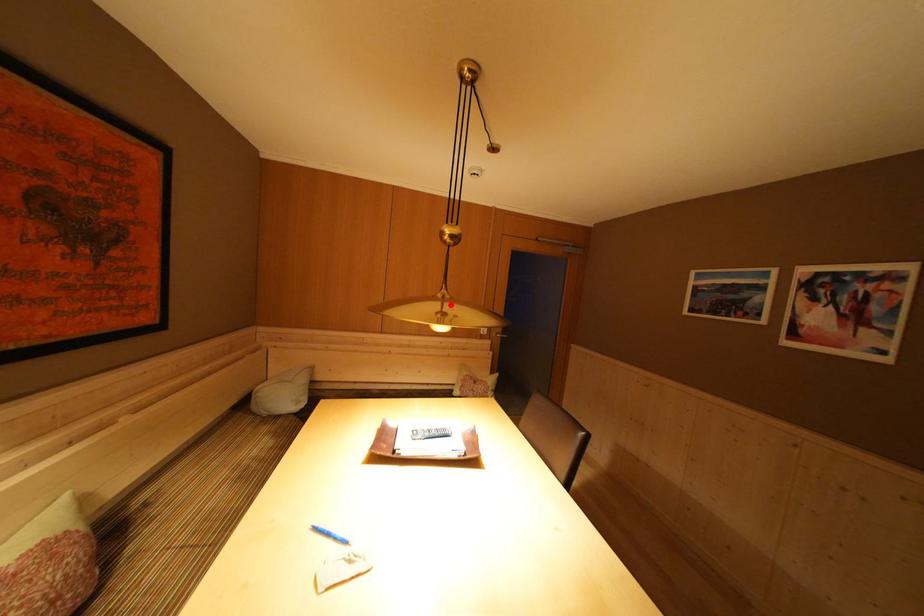
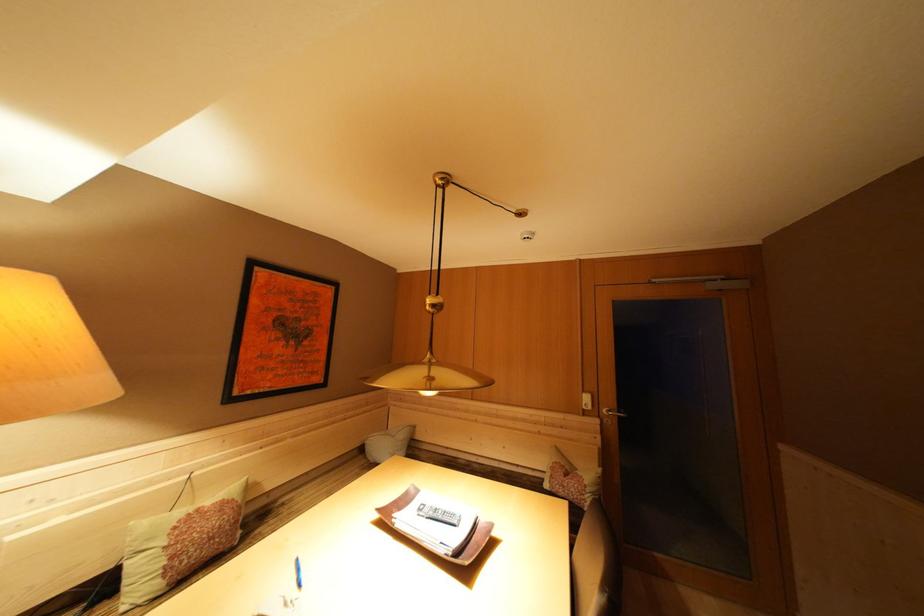
Find the pixel in the second image that matches the highlighted location in the first image.

(438, 369)